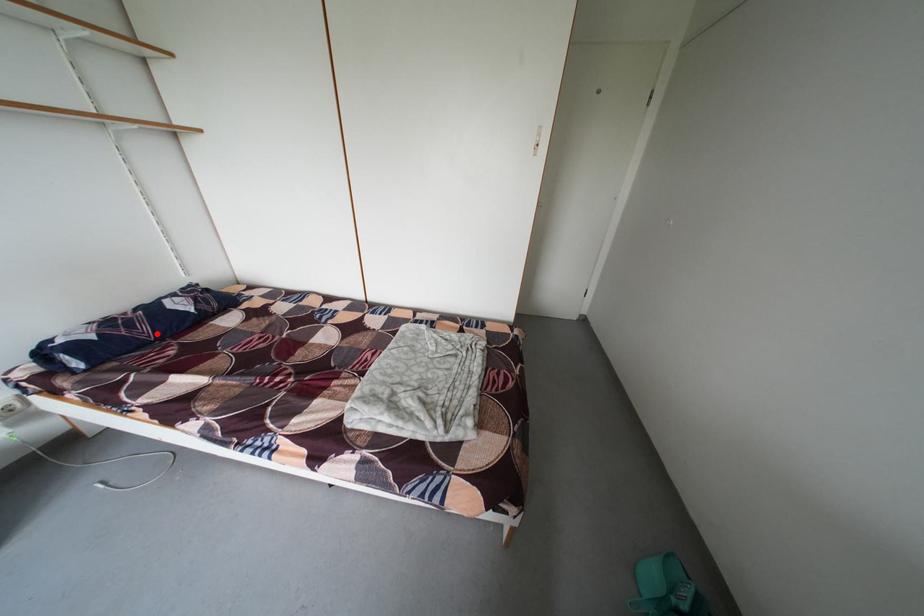
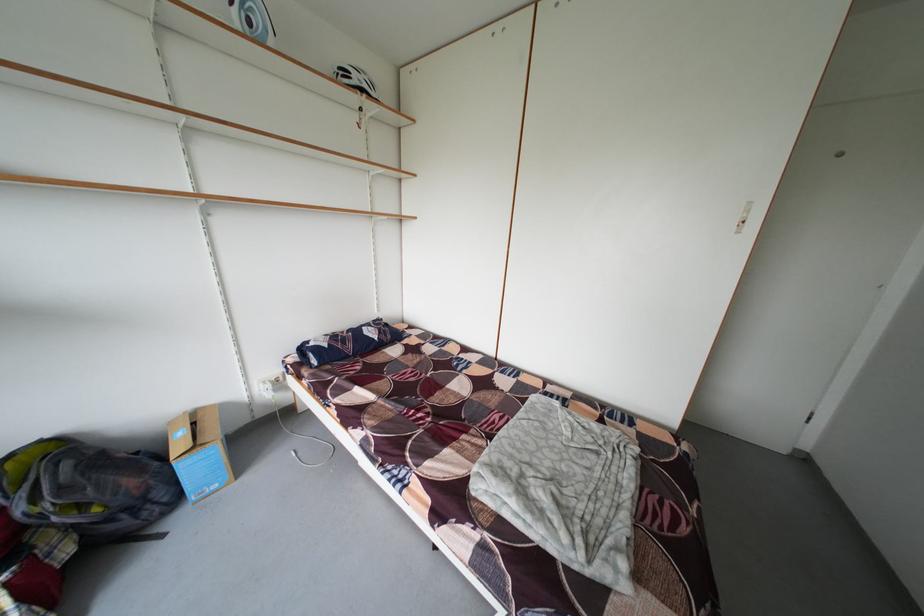
In the second image, find the point that corresponds to the highlighted location in the first image.

(360, 351)